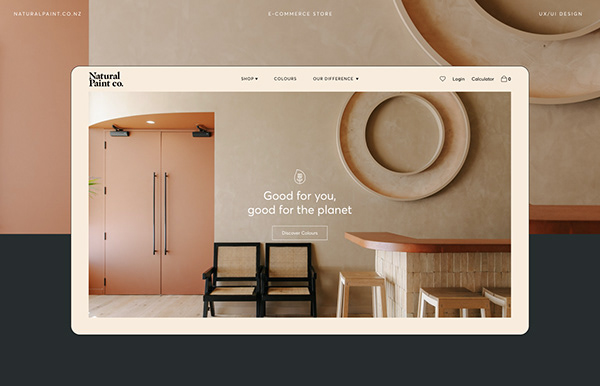
Identify the location of set of chairs. 293,266, 248,263.